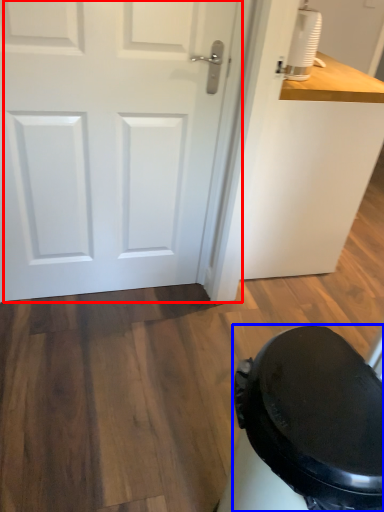
Question: Which of the following is the closest to the observer, door (highlighted by a red box) or potty (highlighted by a blue box)?

Choices:
 (A) door
 (B) potty

Answer: (B)